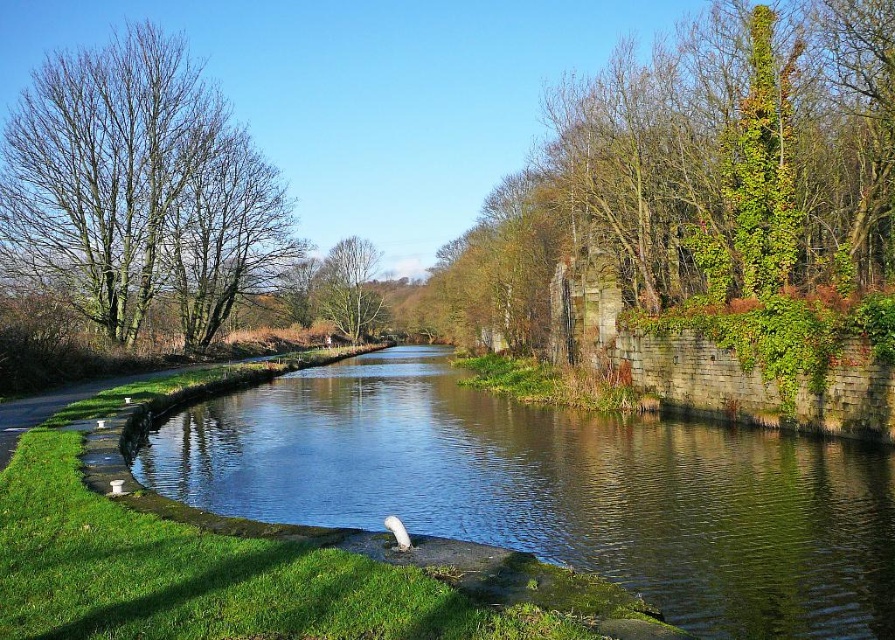
What do you see at coordinates (139, 189) in the screenshot?
I see `green leafy tree at left` at bounding box center [139, 189].

Between green leafy tree at left and green leafy tree at center, which one is positioned lower?

green leafy tree at center

Is point (55, 214) positioned before point (351, 298)?

Yes, it is.

The width and height of the screenshot is (895, 640). In order to click on green leafy tree at left in this screenshot , I will do `click(139, 189)`.

Is point (432, 484) positioned after point (262, 285)?

No.

What do you see at coordinates (557, 490) in the screenshot? I see `green stone river at center` at bounding box center [557, 490].

Between point (275, 403) and point (77, 227), which one is positioned behind?

The point (77, 227) is behind.

I want to click on green stone river at center, so click(557, 490).

Which is above, green stone river at center or green leafy tree at center?

green leafy tree at center

Measure the distance from green stone river at center to green leafy tree at center.

69.95 meters

Which is behind, point (861, 490) or point (372, 252)?

Point (372, 252)

Locate an element on the screen. This screenshot has width=895, height=640. green stone river at center is located at coordinates (557, 490).